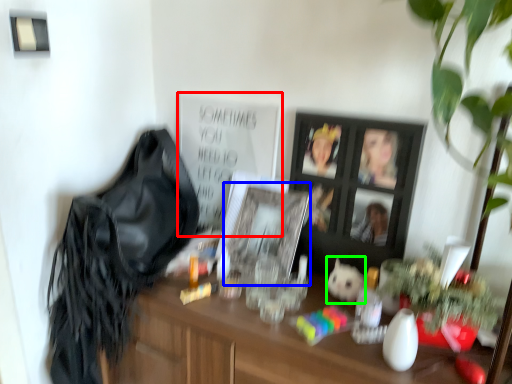
Question: Based on their relative distances, which object is nearer to bulletin board (highlighted by a red box)? Choose from picture frame (highlighted by a blue box) and animal (highlighted by a green box).

Choices:
 (A) picture frame
 (B) animal

Answer: (A)